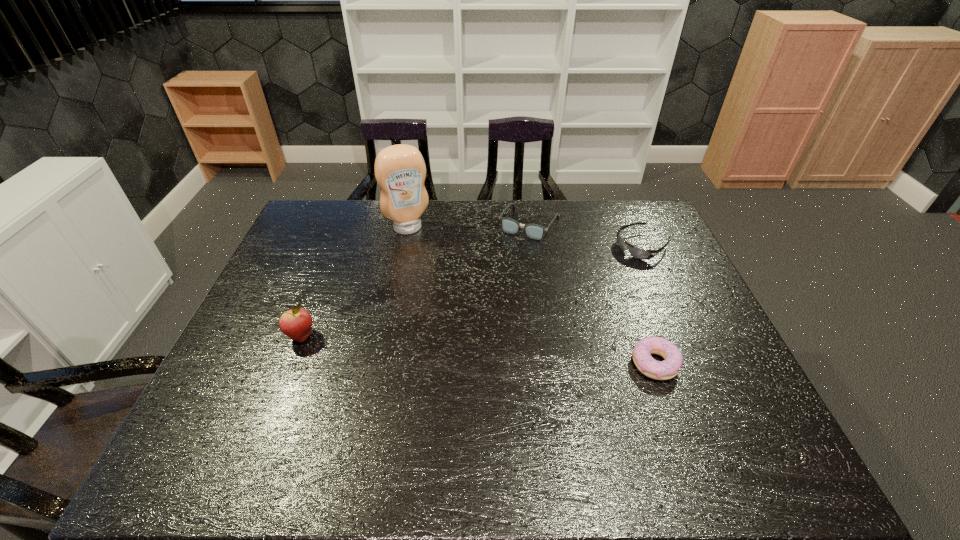
Identify the location of unoccupied position between the spectacles and the condiment. The width and height of the screenshot is (960, 540). coord(468,226).

Find the location of `unoccupied position between the condiment and the sunglasses`. unoccupied position between the condiment and the sunglasses is located at coordinates (525, 237).

Point out which object is positioned as the third nearest to the doughnut. Please provide its 2D coordinates. Your answer should be formatted as a tuple, i.e. [(x, y)], where the tuple contains the x and y coordinates of a point satisfying the conditions above.

[(400, 171)]

Locate an element on the screen. Image resolution: width=960 pixels, height=540 pixels. object that is the fourth closest to the third tallest object is located at coordinates (296, 323).

This screenshot has height=540, width=960. In order to click on free space that satisfies the following two spatial constraints: 1. on the back side of the doughnut; 2. on the right side of the sunglasses in this screenshot , I will do `click(612, 246)`.

Find the location of a particular element. free region that satisfies the following two spatial constraints: 1. on the back side of the sunglasses; 2. on the left side of the doughnut is located at coordinates (612, 246).

Find the location of `blank space that satisfies the following two spatial constraints: 1. on the back side of the sunglasses; 2. on the left side of the leftmost object`. blank space that satisfies the following two spatial constraints: 1. on the back side of the sunglasses; 2. on the left side of the leftmost object is located at coordinates (337, 246).